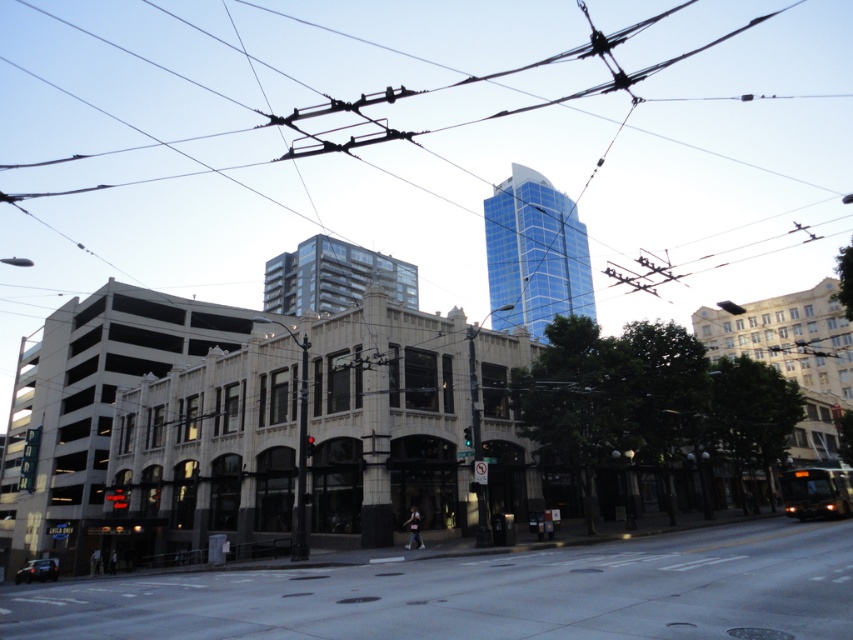
Question: Which point is farther to the camera?

Choices:
 (A) (161, 236)
 (B) (294, 310)
 (C) (541, 253)

Answer: (A)

Question: Considering the real-world distances, which object is closest to the concrete sidewalk at lower center?

Choices:
 (A) blue glassy tower at upper center
 (B) glassy reflective building at center
 (C) metallic wires at upper center

Answer: (B)

Question: Can you confirm if blue glassy tower at upper center is positioned to the left of glassy reflective building at center?

Choices:
 (A) no
 (B) yes

Answer: (A)

Question: Among these objects, which one is nearest to the camera?

Choices:
 (A) metallic wires at upper center
 (B) blue glassy tower at upper center
 (C) concrete sidewalk at lower center
 (D) glassy reflective building at center

Answer: (C)

Question: Observing the image, what is the correct spatial positioning of concrete sidewalk at lower center in reference to glassy reflective building at center?

Choices:
 (A) below
 (B) above

Answer: (A)

Question: In this image, where is concrete sidewalk at lower center located relative to blue glassy tower at upper center?

Choices:
 (A) below
 (B) above

Answer: (A)